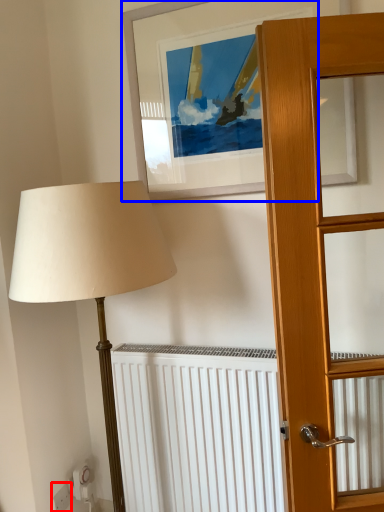
Question: Which point is closer to the camera, electric outlet (highlighted by a red box) or picture frame (highlighted by a blue box)?

Choices:
 (A) electric outlet
 (B) picture frame

Answer: (B)